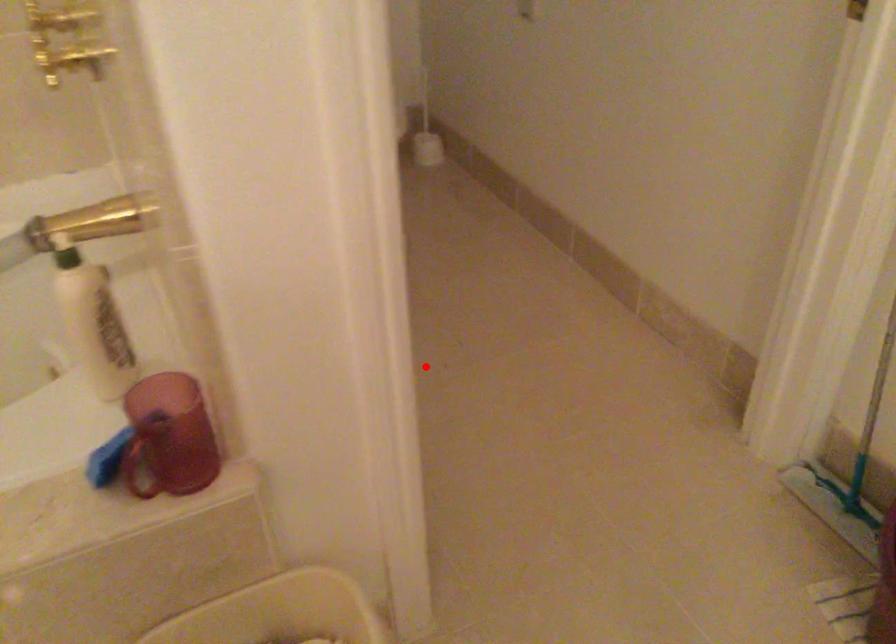
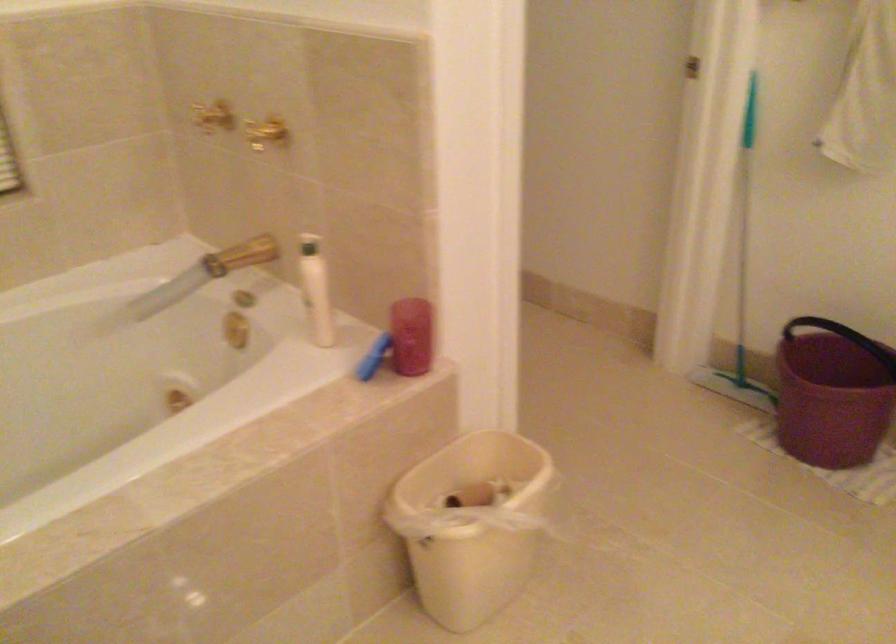
Question: I am providing you with two images of the same scene from different viewpoints. A red point is marked on the first image. Can you still see the location of the red point in image 2?

Choices:
 (A) Yes
 (B) No

Answer: (B)